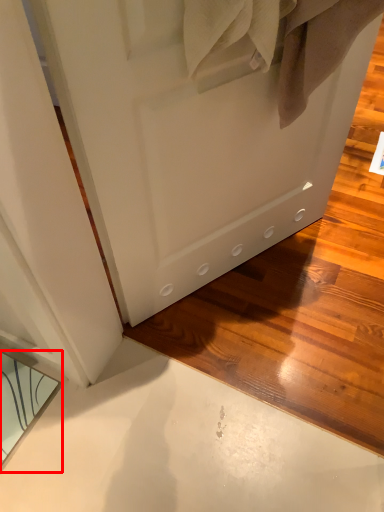
Question: Observing the image, what is the correct spatial positioning of mirror (annotated by the red box) in reference to door?

Choices:
 (A) left
 (B) right

Answer: (A)